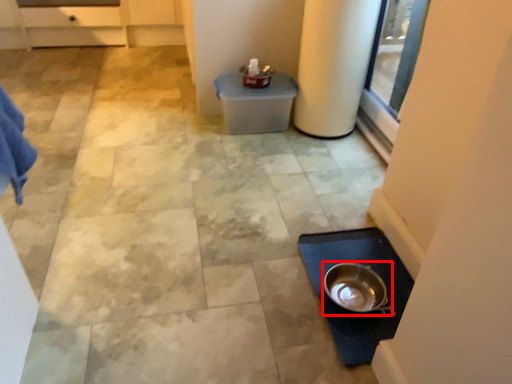
Question: Considering the relative positions of mixing bowl (annotated by the red box) and pillar in the image provided, where is mixing bowl (annotated by the red box) located with respect to the staircase?

Choices:
 (A) right
 (B) left

Answer: (B)